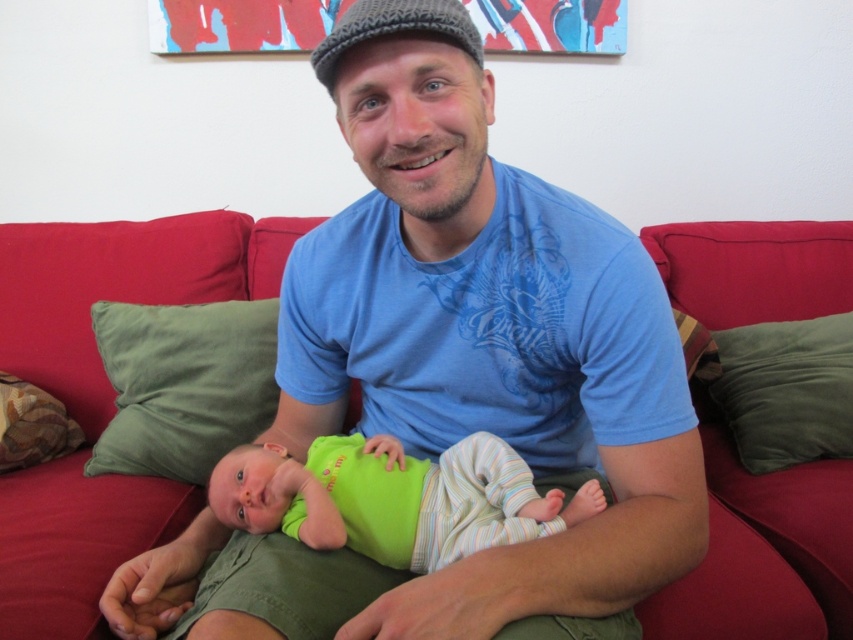
You are standing in front of the sofa and want to place a small decoration. There are two points marked on the wall at coordinates point (x=248, y=369) and point (x=741, y=368). Which point is closer to you where you can easily reach?

Point (x=248, y=369) is closer to the viewer than point (x=741, y=368), so you can easily reach it.

You are a photographer setting up a shoot in this living room. You need to ensure that the blue cotton shirt at center and the patterned fabric pillow at left are both visible in the frame. Given their sizes, which object will appear larger in the photo?

The blue cotton shirt at center will appear larger in the photo because it is taller than the patterned fabric pillow at left.

You are a photographer standing at a distance of 25 inches from the subject. You want to take a closeup shot of the blue cotton shirt at center. Is the current distance sufficient to capture the shirt clearly?

The blue cotton shirt at center is 26.53 inches away from the viewer. Since you are standing at 25 inches, you are closer than the required distance, so you need to move back approximately 1.53 inches to capture the shirt clearly.